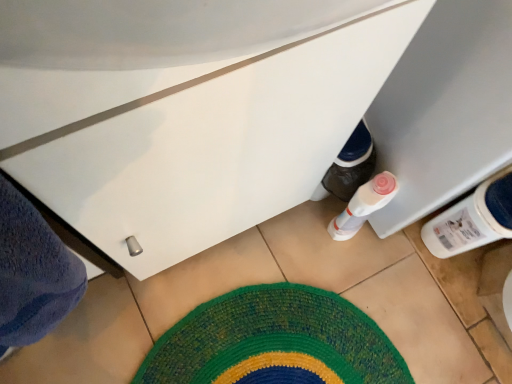
What do you see at coordinates (202, 128) in the screenshot? The image size is (512, 384). I see `white glossy cabinet at lower center` at bounding box center [202, 128].

Locate an element on the screen. white glossy cabinet at lower center is located at coordinates (202, 128).

Is white glossy cabinet at lower center not within white plastic bottle at lower right?

Yes, white glossy cabinet at lower center is not within white plastic bottle at lower right.

Can you confirm if white glossy cabinet at lower center is wider than white plastic bottle at lower right?

No.

Is white glossy cabinet at lower center smaller than white plastic bottle at lower right?

Incorrect, white glossy cabinet at lower center is not smaller in size than white plastic bottle at lower right.

From a real-world perspective, does white glossy cabinet at lower center sit lower than white plastic bottle at lower right?

No.

Is white plastic bottle at lower right touching multicolored woven mat at center?

No, white plastic bottle at lower right is not making contact with multicolored woven mat at center.

In the scene shown: How far apart are white plastic bottle at lower right and multicolored woven mat at center?

white plastic bottle at lower right and multicolored woven mat at center are 14.74 inches apart from each other.

Is white plastic bottle at lower right facing away from multicolored woven mat at center?

No, white plastic bottle at lower right is not facing away from multicolored woven mat at center.

From the image's perspective, which one is positioned lower, white plastic bottle at lower right or multicolored woven mat at center?

multicolored woven mat at center.

From a real-world perspective, which object rests below the other?

white plastic bottle at lower right, from a real-world perspective.

From the image's perspective, is white plastic bottle at lower right on top of white glossy cabinet at lower center?

Actually, white plastic bottle at lower right appears below white glossy cabinet at lower center in the image.

Are white plastic bottle at lower right and white glossy cabinet at lower center located far from each other?

No, there isn't a large distance between white plastic bottle at lower right and white glossy cabinet at lower center.

Is white plastic bottle at lower right closer to camera compared to white glossy cabinet at lower center?

No, it is not.

Is white glossy cabinet at lower center bigger or smaller than multicolored woven mat at center?

In the image, white glossy cabinet at lower center appears to be larger than multicolored woven mat at center.

Is white glossy cabinet at lower center spatially inside multicolored woven mat at center, or outside of it?

white glossy cabinet at lower center cannot be found inside multicolored woven mat at center.

Does point (15, 90) come behind point (205, 363)?

No, it is in front of (205, 363).

From the picture: Considering the sizes of multicolored woven mat at center and white plastic bottle at lower right in the image, is multicolored woven mat at center taller or shorter than white plastic bottle at lower right?

Clearly, multicolored woven mat at center is shorter compared to white plastic bottle at lower right.

Is multicolored woven mat at center next to white plastic bottle at lower right and touching it?

No, multicolored woven mat at center is not next to white plastic bottle at lower right.

Who is bigger, multicolored woven mat at center or white plastic bottle at lower right?

With larger size is white plastic bottle at lower right.

Does point (323, 360) come behind point (445, 238)?

No.

Is multicolored woven mat at center bigger or smaller than white glossy cabinet at lower center?

Considering their sizes, multicolored woven mat at center takes up less space than white glossy cabinet at lower center.

Between point (278, 352) and point (307, 114), which one is positioned in front?

The point (307, 114) is more forward.

How many degrees apart are the facing directions of multicolored woven mat at center and white glossy cabinet at lower center?

The facing directions of multicolored woven mat at center and white glossy cabinet at lower center are 89.9 degrees apart.

Who is more distant, multicolored woven mat at center or white glossy cabinet at lower center?

multicolored woven mat at center is more distant.

The image size is (512, 384). I want to click on cabinetry in front of the white plastic bottle at lower right, so click(202, 128).

The height and width of the screenshot is (384, 512). Identify the location of mat behind the white plastic bottle at lower right. (274, 342).

Based on their spatial positions, is multicolored woven mat at center or white plastic bottle at lower right further from white glossy cabinet at lower center?

multicolored woven mat at center is positioned further to the anchor white glossy cabinet at lower center.

From the image, which object appears to be farther from multicolored woven mat at center, white plastic bottle at lower right or white glossy cabinet at lower center?

white glossy cabinet at lower center lies further to multicolored woven mat at center than the other object.

Looking at the image, which one is located closer to white plastic bottle at lower right, white glossy cabinet at lower center or multicolored woven mat at center?

Based on the image, multicolored woven mat at center appears to be nearer to white plastic bottle at lower right.

When comparing their distances from white glossy cabinet at lower center, does white plastic bottle at lower right or multicolored woven mat at center seem closer?

white plastic bottle at lower right is closer to white glossy cabinet at lower center.

Based on their spatial positions, is multicolored woven mat at center or white glossy cabinet at lower center further from white plastic bottle at lower right?

white glossy cabinet at lower center is further to white plastic bottle at lower right.

From the image, which object appears to be farther from multicolored woven mat at center, white glossy cabinet at lower center or white plastic bottle at lower right?

Among the two, white glossy cabinet at lower center is located further to multicolored woven mat at center.

You are a GUI agent. You are given a task and a screenshot of the screen. Output one action in this format:
    pyautogui.click(x=<x>, y=<y>)
    Task: Click on the bottle between white glossy cabinet at lower center and multicolored woven mat at center in the front-back direction
    The image size is (512, 384).
    Given the screenshot: What is the action you would take?
    pyautogui.click(x=473, y=219)